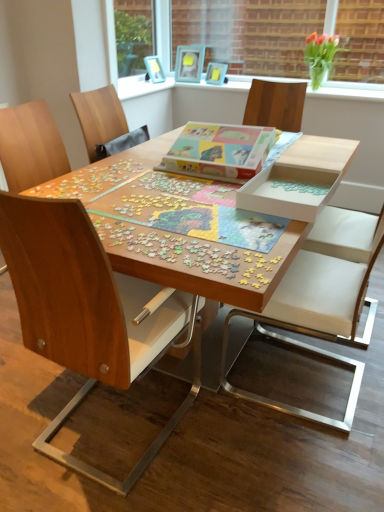
The height and width of the screenshot is (512, 384). Find the location of `free space in front of white leather chair at center, which is the 2th chair in left-to-right order`. free space in front of white leather chair at center, which is the 2th chair in left-to-right order is located at coordinates (300, 470).